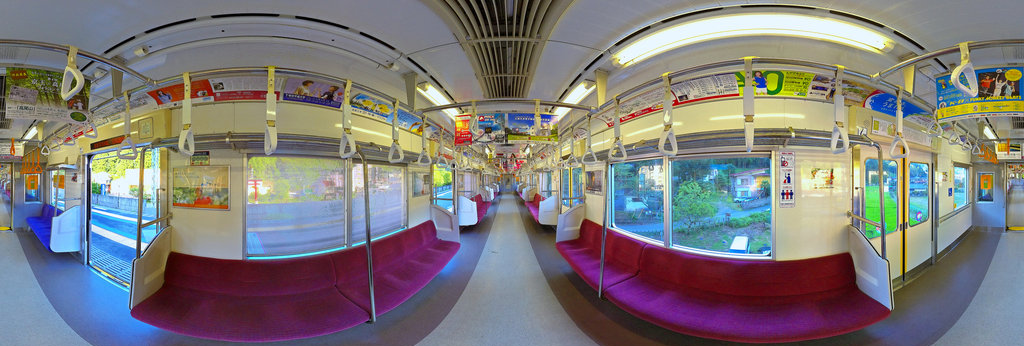
At what (x,y) coordinates should I click in order to perform the action: click on light. Please return your answer as a coordinate pair (x, y). Looking at the image, I should click on (748, 25).